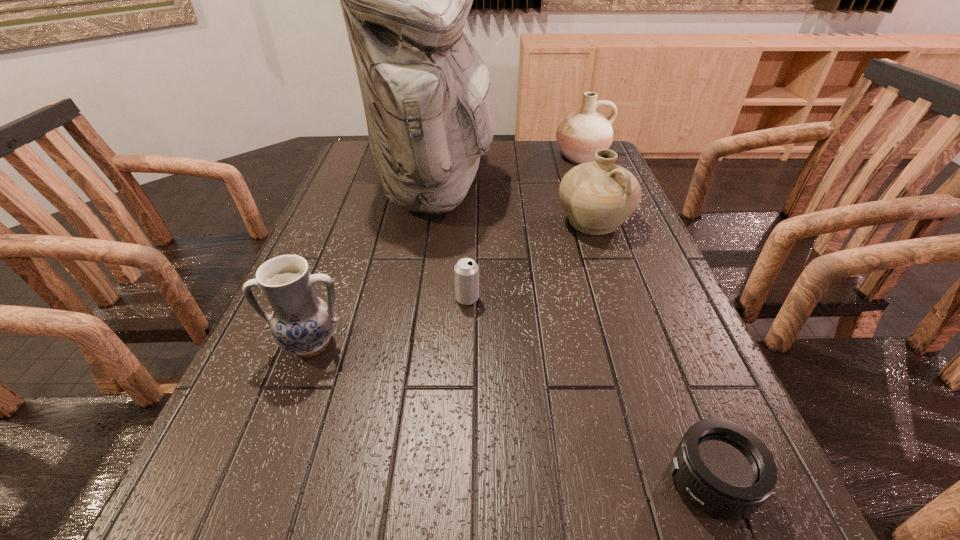
Locate an element on the screen. backpack present at the left edge is located at coordinates [x=430, y=105].

This screenshot has height=540, width=960. What are the coordinates of `pottery present at the left edge` in the screenshot? It's located at (301, 323).

Find the location of `telephoto lens positioned at the right edge`. telephoto lens positioned at the right edge is located at coordinates (723, 469).

Identify the location of object that is at the far left corner. (430, 105).

Find the location of `object located in the far right corner section of the desktop`. object located in the far right corner section of the desktop is located at coordinates (581, 134).

Where is `object that is at the near right corner`? This screenshot has width=960, height=540. object that is at the near right corner is located at coordinates [723, 469].

You are a GUI agent. You are given a task and a screenshot of the screen. Output one action in this format:
    pyautogui.click(x=<x>, y=<y>)
    Task: Click on the free region at the far edge of the desktop
    
    Given the screenshot: What is the action you would take?
    pyautogui.click(x=498, y=160)

In order to click on vacant space at the left edge of the desktop in this screenshot , I will do `click(295, 422)`.

Image resolution: width=960 pixels, height=540 pixels. Identify the location of free space at the right edge of the desktop. (599, 265).

Locate an element on the screen. vacant region at the far left corner of the desktop is located at coordinates (372, 151).